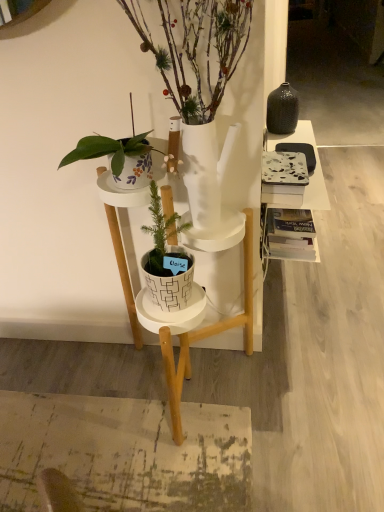
This screenshot has width=384, height=512. I want to click on blank area to the left of white matte plant stand at center, so click(76, 402).